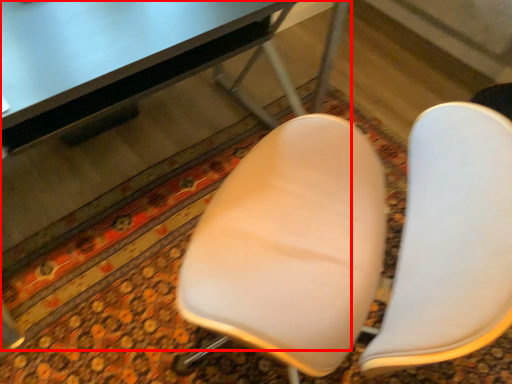
Question: Considering the relative positions of table (annotated by the red box) and chair in the image provided, where is table (annotated by the red box) located with respect to the staircase?

Choices:
 (A) left
 (B) right

Answer: (A)